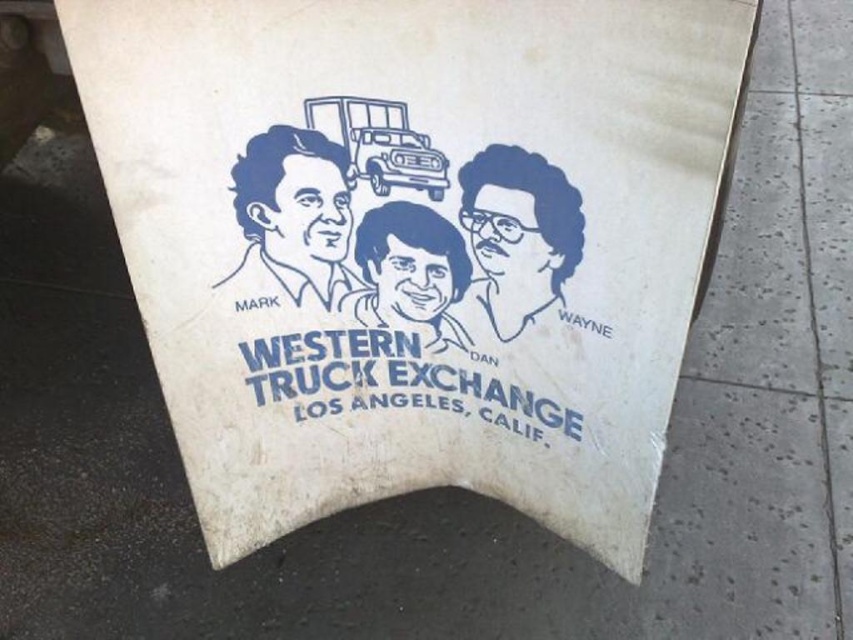
You are a delivery person trying to read the sign. You see the blue line drawing face at upper center and the matte blue head at center. Which one is more to the right?

The blue line drawing face at upper center is more to the right because it is positioned on the right side of the matte blue head at center.